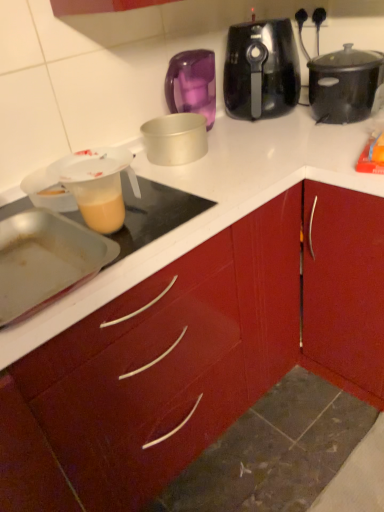
Question: Is translucent plastic measuring cup at left, the 2th kitchen appliance positioned from the bottom, wider or thinner than black matte slow cooker at upper right, which appears as the first slow cooker when viewed from the right?

Choices:
 (A) wide
 (B) thin

Answer: (B)

Question: From their relative heights in the image, would you say translucent plastic measuring cup at left, the 2th kitchen appliance positioned from the top, is taller or shorter than black matte slow cooker at upper right, which appears as the first slow cooker when viewed from the right?

Choices:
 (A) tall
 (B) short

Answer: (B)

Question: Based on their relative distances, which object is farther from the black plastic slow cooker at upper center, acting as the 1th slow cooker starting from the left?

Choices:
 (A) metallic silver baking pan at left, which is counted as the first kitchen appliance, starting from the front
 (B) translucent plastic measuring cup at left, marked as the 2th kitchen appliance in a front-to-back arrangement
 (C) silver metallic cake pan at center, arranged as the first kitchen appliance when viewed from the back
 (D) black matte slow cooker at upper right, arranged as the 2th slow cooker when viewed from the left
 (E) glossy wood cabinet at center

Answer: (A)

Question: Which of these objects is positioned closest to the silver metallic cake pan at center, the 3th kitchen appliance positioned from the front?

Choices:
 (A) glossy wood cabinet at center
 (B) translucent plastic measuring cup at left, the 2th kitchen appliance positioned from the bottom
 (C) metallic silver baking pan at left, the 3th kitchen appliance in the top-to-bottom sequence
 (D) black matte slow cooker at upper right, arranged as the 2th slow cooker when viewed from the left
 (E) black plastic slow cooker at upper center, acting as the 1th slow cooker starting from the left

Answer: (E)